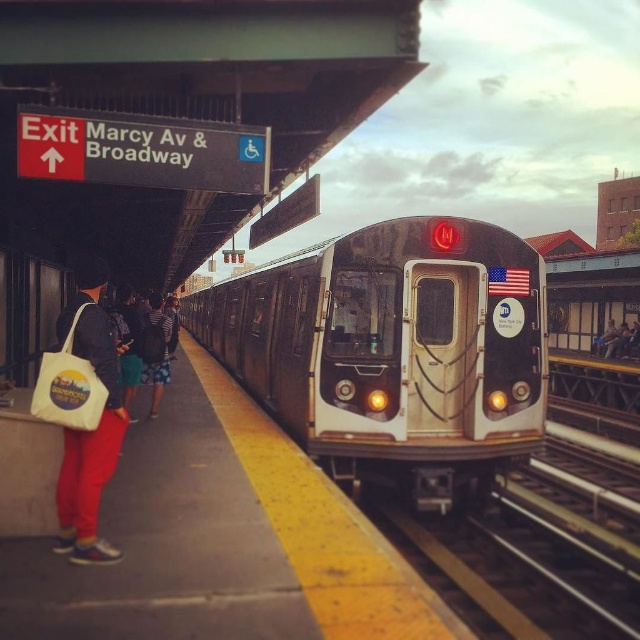
Question: Which of the following is the closest to the observer?

Choices:
 (A) (86, 488)
 (B) (412, 348)
 (C) (161, 312)

Answer: (A)

Question: Is matte white tote bag at lower left further to camera compared to striped shirt at center?

Choices:
 (A) yes
 (B) no

Answer: (B)

Question: Which point is farther to the camera?

Choices:
 (A) (148, 348)
 (B) (118, 416)

Answer: (A)

Question: Among these points, which one is nearest to the camera?

Choices:
 (A) (445, 336)
 (B) (60, 545)

Answer: (B)

Question: Does silver metallic train at center have a greater width compared to matte white tote bag at lower left?

Choices:
 (A) yes
 (B) no

Answer: (A)

Question: Does matte white tote bag at lower left appear over striped shirt at center?

Choices:
 (A) yes
 (B) no

Answer: (B)